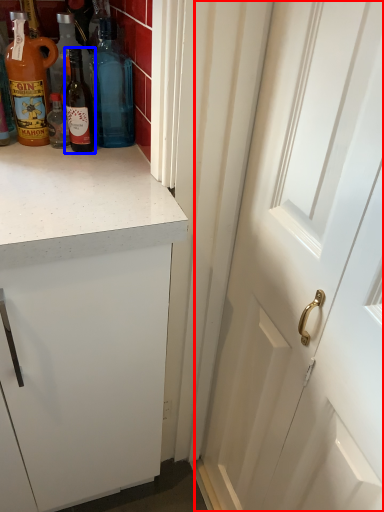
Question: Among these objects, which one is farthest to the camera, door (highlighted by a red box) or bottle (highlighted by a blue box)?

Choices:
 (A) door
 (B) bottle

Answer: (B)